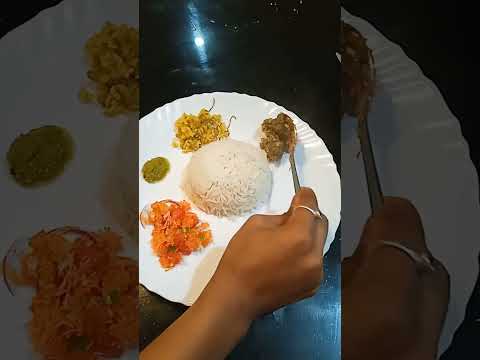
This screenshot has height=360, width=480. Identify the location of spoon. [x=370, y=153], [x=295, y=175].